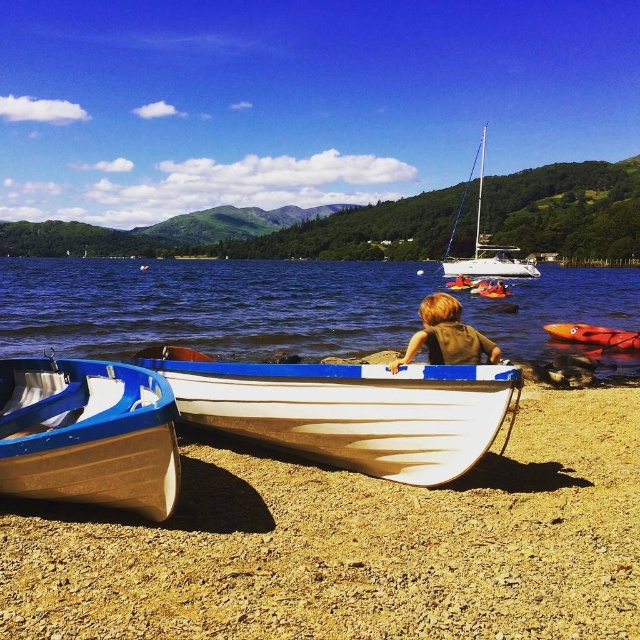
Is orange plastic kayak at center further to camera compared to white glossy kayak at center?

No, orange plastic kayak at center is in front of white glossy kayak at center.

Can you confirm if orange plastic kayak at center is wider than white glossy kayak at center?

Incorrect, orange plastic kayak at center's width does not surpass white glossy kayak at center's.

Who is more forward, (593, 333) or (508, 289)?

Point (593, 333) is in front.

Identify the location of orange plastic kayak at center. (593, 336).

Is blue water at center smaller than white glossy sailboat at upper center?

Yes, blue water at center is smaller than white glossy sailboat at upper center.

How far apart are blue water at center and white glossy sailboat at upper center?

blue water at center is 22.17 meters away from white glossy sailboat at upper center.

This screenshot has height=640, width=640. Describe the element at coordinates (209, 305) in the screenshot. I see `blue water at center` at that location.

Locate an element on the screen. blue water at center is located at coordinates (209, 305).

Which of these two, brown fabric shirt at center or white glossy kayak at center, stands taller?

Standing taller between the two is white glossy kayak at center.

Who is lower down, brown fabric shirt at center or white glossy kayak at center?

Positioned lower is brown fabric shirt at center.

Who is more distant from viewer, (394, 369) or (483, 296)?

Positioned behind is point (483, 296).

Find the location of a particular element. brown fabric shirt at center is located at coordinates (445, 336).